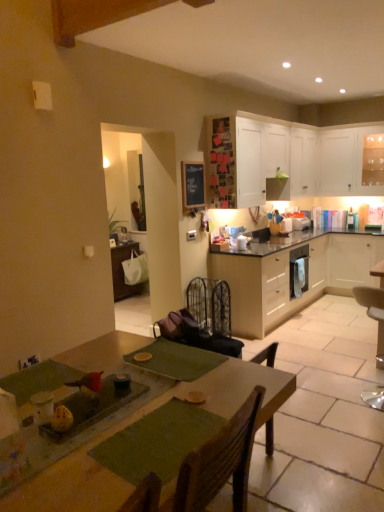
This screenshot has height=512, width=384. Identify the location of black wrought iron armchair at center. (210, 304).

What do you see at coordinates (371, 301) in the screenshot? I see `metallic silver chair at lower right` at bounding box center [371, 301].

The width and height of the screenshot is (384, 512). Find the location of `white glossy microwave at upper right, which is the first appliance in front-to-back order`. white glossy microwave at upper right, which is the first appliance in front-to-back order is located at coordinates (285, 226).

This screenshot has height=512, width=384. Describe the element at coordinates (289, 275) in the screenshot. I see `light wood/veneer cabinets at center, the 1th cabinetry when ordered from bottom to top` at that location.

Describe the element at coordinates (136, 420) in the screenshot. I see `green fabric table at center` at that location.

Image resolution: width=384 pixels, height=512 pixels. What do you see at coordinates (301, 223) in the screenshot? I see `white glossy microwave at upper right, the 1th appliance in the back-to-front sequence` at bounding box center [301, 223].

The width and height of the screenshot is (384, 512). In order to click on black wrought iron armchair at center in this screenshot , I will do `click(210, 304)`.

At what (x,y) coordinates should I click in order to perform the action: click on table that appears above the black wrought iron armchair at center (from a real-world perspective). Please return your answer as a coordinate pair (x, y). This screenshot has height=512, width=384. Looking at the image, I should click on (136, 420).

Is green fabric table at center facing away from black wrought iron armchair at center?

That's not correct — green fabric table at center is not looking away from black wrought iron armchair at center.

Who is shorter, green fabric table at center or black wrought iron armchair at center?

black wrought iron armchair at center is shorter.

Is green fabric table at center not near black wrought iron armchair at center?

Yes.

From the image's perspective, which object appears higher, white glossy microwave at upper right, the second appliance positioned from the front, or white glossy microwave at upper right, which is the first appliance in front-to-back order?

white glossy microwave at upper right, the second appliance positioned from the front, appears higher in the image.

Is white glossy microwave at upper right, the second appliance positioned from the front, inside or outside of white glossy microwave at upper right, which is the first appliance in front-to-back order?

white glossy microwave at upper right, the second appliance positioned from the front, is not enclosed by white glossy microwave at upper right, which is the first appliance in front-to-back order.

Is there a large distance between white glossy microwave at upper right, the 1th appliance in the back-to-front sequence, and white glossy microwave at upper right, which is the first appliance in front-to-back order?

No.

Is white matte cabinet at upper right, the 1th cabinetry viewed from the top, behind white glossy microwave at upper right, the second appliance positioned from the front?

No, white matte cabinet at upper right, the 1th cabinetry viewed from the top, is closer to the viewer.

Considering the sizes of white matte cabinet at upper right, which is the 4th cabinetry from bottom to top, and white glossy microwave at upper right, the second appliance positioned from the front, in the image, is white matte cabinet at upper right, which is the 4th cabinetry from bottom to top, taller or shorter than white glossy microwave at upper right, the second appliance positioned from the front,?

white matte cabinet at upper right, which is the 4th cabinetry from bottom to top, is taller than white glossy microwave at upper right, the second appliance positioned from the front.

Is white matte cabinet at upper right, the 1th cabinetry viewed from the top, placed right next to white glossy microwave at upper right, the second appliance positioned from the front?

No, white matte cabinet at upper right, the 1th cabinetry viewed from the top, is not making contact with white glossy microwave at upper right, the second appliance positioned from the front.

Is green fabric table at center facing away from white glossy microwave at upper right, the 1th appliance in the back-to-front sequence?

No, white glossy microwave at upper right, the 1th appliance in the back-to-front sequence, is not at the back of green fabric table at center.

Which of these two, green fabric table at center or white glossy microwave at upper right, the 1th appliance in the back-to-front sequence, is thinner?

With smaller width is white glossy microwave at upper right, the 1th appliance in the back-to-front sequence.

From the image's perspective, which one is positioned lower, green fabric table at center or white glossy microwave at upper right, the 1th appliance in the back-to-front sequence?

From the image's view, green fabric table at center is below.

Does point (234, 364) appear closer or farther from the camera than point (305, 228)?

Point (234, 364).

At what (x,y) coordinates should I click in order to perform the action: click on the 2nd cabinetry positioned above the light wood/veneer cabinets at center, the 4th cabinetry from the top (from the image's perspective). Please return your answer as a coordinate pair (x, y). The image size is (384, 512). Looking at the image, I should click on (243, 159).

Considering the sizes of objects white matte cabinet at upper center, placed as the third cabinetry when sorted from bottom to top, and light wood/veneer cabinets at center, the 1th cabinetry when ordered from bottom to top, in the image provided, who is taller, white matte cabinet at upper center, placed as the third cabinetry when sorted from bottom to top, or light wood/veneer cabinets at center, the 1th cabinetry when ordered from bottom to top,?

With more height is light wood/veneer cabinets at center, the 1th cabinetry when ordered from bottom to top.

From the image's perspective, is white matte cabinet at upper center, the second cabinetry in the top-to-bottom sequence, below light wood/veneer cabinets at center, the 1th cabinetry when ordered from bottom to top?

No, from the image's perspective, white matte cabinet at upper center, the second cabinetry in the top-to-bottom sequence, is not below light wood/veneer cabinets at center, the 1th cabinetry when ordered from bottom to top.

Does white matte cabinet at upper center, the second cabinetry in the top-to-bottom sequence, come in front of light wood/veneer cabinets at center, the 4th cabinetry from the top?

Yes, it is in front of light wood/veneer cabinets at center, the 4th cabinetry from the top.

From a real-world perspective, is white matte cabinet at right, which appears as the second cabinetry when ordered from the bottom, beneath black wrought iron armchair at center?

No.

Which is in front, point (342, 247) or point (194, 318)?

The point (194, 318) is closer.

I want to click on the 3rd cabinetry behind the black wrought iron armchair at center, counting from the anchor's position, so click(x=352, y=261).

Considering the sizes of white matte cabinet at right, the 3th cabinetry viewed from the top, and black wrought iron armchair at center in the image, is white matte cabinet at right, the 3th cabinetry viewed from the top, taller or shorter than black wrought iron armchair at center?

In the image, white matte cabinet at right, the 3th cabinetry viewed from the top, appears to be taller than black wrought iron armchair at center.

In the image, is white glossy microwave at upper right, which is counted as the second appliance, starting from the back, on the left side or the right side of metallic silver chair at lower right?

In the image, white glossy microwave at upper right, which is counted as the second appliance, starting from the back, appears on the left side of metallic silver chair at lower right.

Can you see white glossy microwave at upper right, which is the first appliance in front-to-back order, touching metallic silver chair at lower right?

They are not placed beside each other.

At what (x,y) coordinates should I click in order to perform the action: click on chair on the right of white glossy microwave at upper right, which is counted as the second appliance, starting from the back. Please return your answer as a coordinate pair (x, y). The image size is (384, 512). Looking at the image, I should click on (371, 301).

In the scene shown: Is metallic silver chair at lower right at the back of white glossy microwave at upper right, which is the first appliance in front-to-back order?

No, white glossy microwave at upper right, which is the first appliance in front-to-back order, is not facing away from metallic silver chair at lower right.

Find the location of a particular element. The image size is (384, 512). armchair behind the green fabric table at center is located at coordinates (210, 304).

This screenshot has width=384, height=512. There is a white glossy microwave at upper right, the second appliance positioned from the front. What are the coordinates of `appliance above it (from a real-world perspective)` in the screenshot? It's located at (285, 226).

Considering their positions, is metallic silver chair at lower right positioned closer to white glossy microwave at upper right, the 1th appliance in the back-to-front sequence, than white matte cabinet at right, the 3th cabinetry viewed from the top?

Among the two, white matte cabinet at right, the 3th cabinetry viewed from the top, is located nearer to white glossy microwave at upper right, the 1th appliance in the back-to-front sequence.

Based on their spatial positions, is white matte cabinet at upper right, the 1th cabinetry viewed from the top, or green fabric table at center closer to light wood/veneer cabinets at center, the 1th cabinetry when ordered from bottom to top?

white matte cabinet at upper right, the 1th cabinetry viewed from the top, is closer to light wood/veneer cabinets at center, the 1th cabinetry when ordered from bottom to top.

Considering their positions, is white matte cabinet at upper center, the second cabinetry in the top-to-bottom sequence, positioned closer to metallic silver chair at lower right than white matte cabinet at upper right, the 1th cabinetry viewed from the top?

Based on the image, white matte cabinet at upper center, the second cabinetry in the top-to-bottom sequence, appears to be nearer to metallic silver chair at lower right.

From the picture: Looking at the image, which one is located closer to light wood/veneer cabinets at center, the 1th cabinetry when ordered from bottom to top, green fabric table at center or white matte cabinet at right, which appears as the second cabinetry when ordered from the bottom?

white matte cabinet at right, which appears as the second cabinetry when ordered from the bottom, is closer to light wood/veneer cabinets at center, the 1th cabinetry when ordered from bottom to top.

Looking at the image, which one is located closer to white matte cabinet at upper center, placed as the third cabinetry when sorted from bottom to top, white glossy microwave at upper right, which is the first appliance in front-to-back order, or white matte cabinet at right, the 3th cabinetry viewed from the top?

The object closer to white matte cabinet at upper center, placed as the third cabinetry when sorted from bottom to top, is white glossy microwave at upper right, which is the first appliance in front-to-back order.

From the image, which object appears to be farther from white matte cabinet at upper right, which is the 4th cabinetry from bottom to top, black wrought iron armchair at center or metallic silver chair at lower right?

metallic silver chair at lower right is positioned further to the anchor white matte cabinet at upper right, which is the 4th cabinetry from bottom to top.

Consider the image. Based on their spatial positions, is black wrought iron armchair at center or white glossy microwave at upper right, which is the first appliance in front-to-back order, further from green fabric table at center?

white glossy microwave at upper right, which is the first appliance in front-to-back order, is further to green fabric table at center.

Considering their positions, is white matte cabinet at right, the 3th cabinetry viewed from the top, positioned further to light wood/veneer cabinets at center, the 1th cabinetry when ordered from bottom to top, than white matte cabinet at upper center, the second cabinetry in the top-to-bottom sequence?

Among the two, white matte cabinet at upper center, the second cabinetry in the top-to-bottom sequence, is located further to light wood/veneer cabinets at center, the 1th cabinetry when ordered from bottom to top.

Image resolution: width=384 pixels, height=512 pixels. Find the location of `chair between green fabric table at center and white glossy microwave at upper right, which is the first appliance in front-to-back order, along the z-axis`. chair between green fabric table at center and white glossy microwave at upper right, which is the first appliance in front-to-back order, along the z-axis is located at coordinates point(371,301).

You are a GUI agent. You are given a task and a screenshot of the screen. Output one action in this format:
    pyautogui.click(x=<x>, y=<y>)
    Task: Click on the cabinetry between white matte cabinet at upper right, which is the 4th cabinetry from bottom to top, and white matte cabinet at right, the 3th cabinetry viewed from the top, in the vertical direction
    The width and height of the screenshot is (384, 512).
    Given the screenshot: What is the action you would take?
    pyautogui.click(x=243, y=159)

The height and width of the screenshot is (512, 384). Identify the location of armchair between green fabric table at center and white matte cabinet at upper right, the 1th cabinetry viewed from the top, in the front-back direction. (210, 304).

The width and height of the screenshot is (384, 512). Find the location of `appliance between white glossy microwave at upper right, which is counted as the second appliance, starting from the back, and white matte cabinet at right, which appears as the second cabinetry when ordered from the bottom, in the horizontal direction`. appliance between white glossy microwave at upper right, which is counted as the second appliance, starting from the back, and white matte cabinet at right, which appears as the second cabinetry when ordered from the bottom, in the horizontal direction is located at coordinates (301, 223).